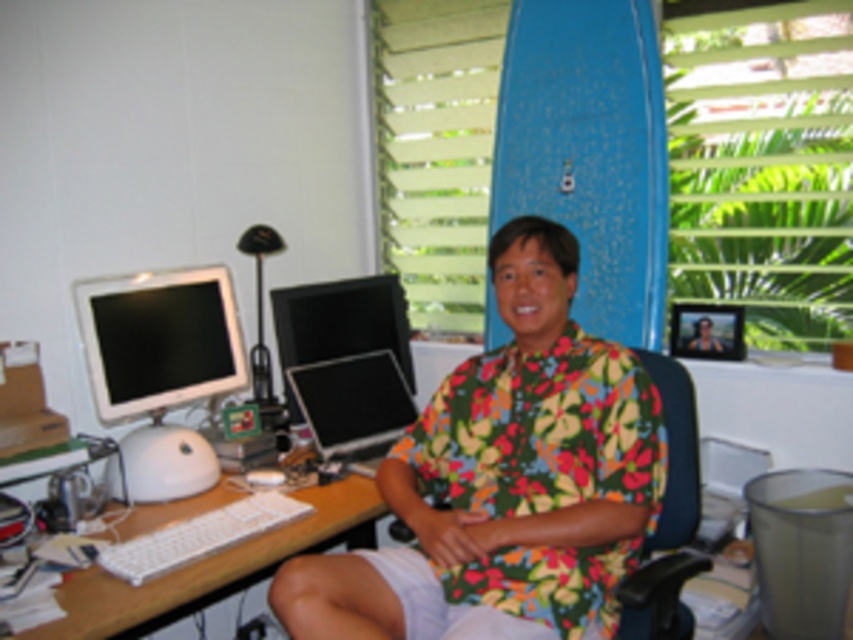
You are a delivery person who needs to place a package on the desk. The package is 1.5 meters long. Can you fit it between the blue fabric swivel chair at center and the edge of the desk?

The distance between the blue fabric swivel chair at center and the edge of the desk is 1.51 meters. Since the package is 1.5 meters long, it will fit with a small amount of space to spare.

You are organizing a virtual meeting and need to ensure participants can see the presenter clearly. The presenter is wearing a floral fabric shirt at center and has a white plastic keyboard at lower left on their desk. Which item is positioned to the right of the other?

The floral fabric shirt at center is to the right of the white plastic keyboard at lower left.